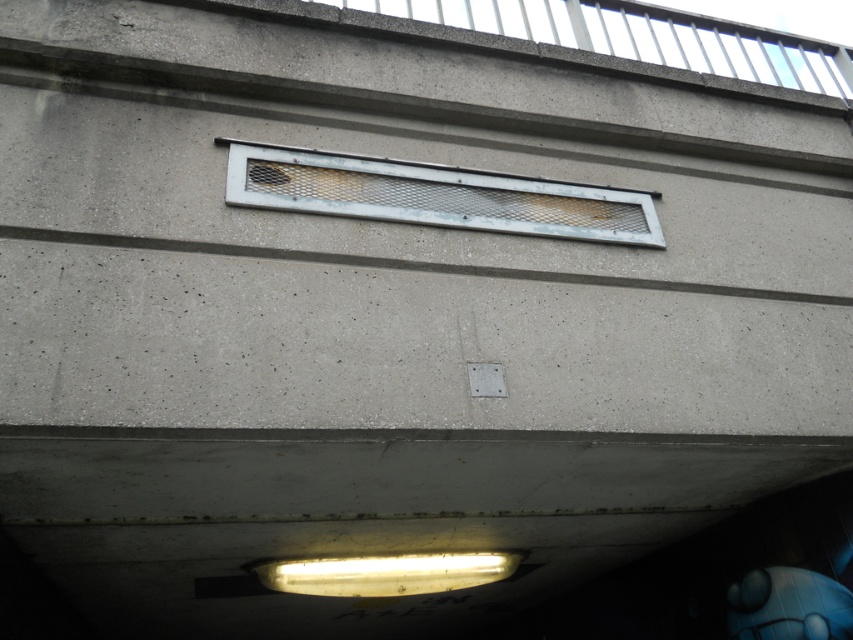
Is metal mesh vent at center closer to the viewer compared to metal mesh vent at upper center?

Yes, metal mesh vent at center is in front of metal mesh vent at upper center.

Which is in front, point (581, 205) or point (520, 36)?

Positioned in front is point (581, 205).

This screenshot has width=853, height=640. Identify the location of metal mesh vent at center. (434, 195).